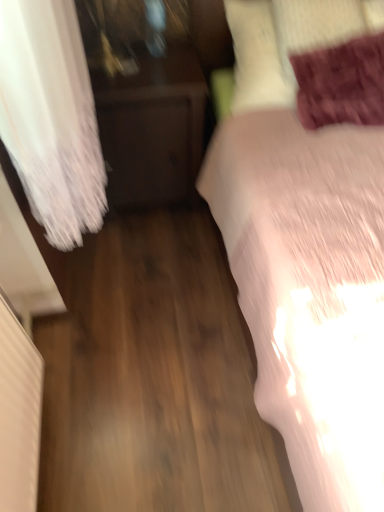
The height and width of the screenshot is (512, 384). In order to click on empty space that is ontop of dark wood nightstand at left in this screenshot , I will do `click(112, 58)`.